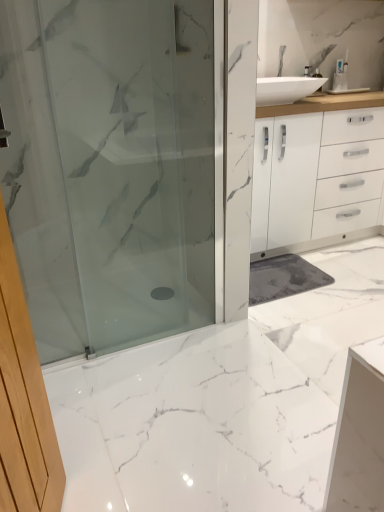
Image resolution: width=384 pixels, height=512 pixels. Identify the location of empty space that is ontop of white marble floor at center (from a real-world perspective). (279, 328).